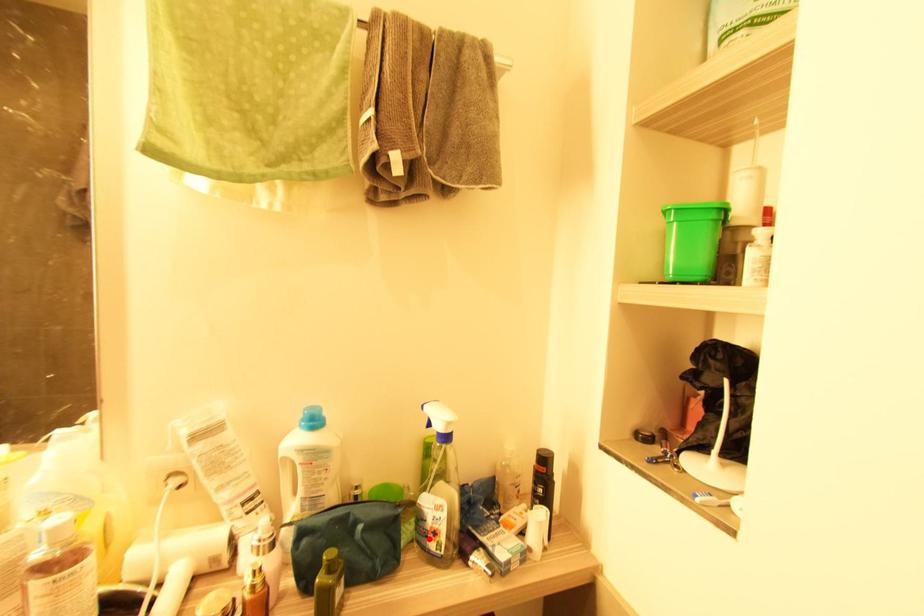
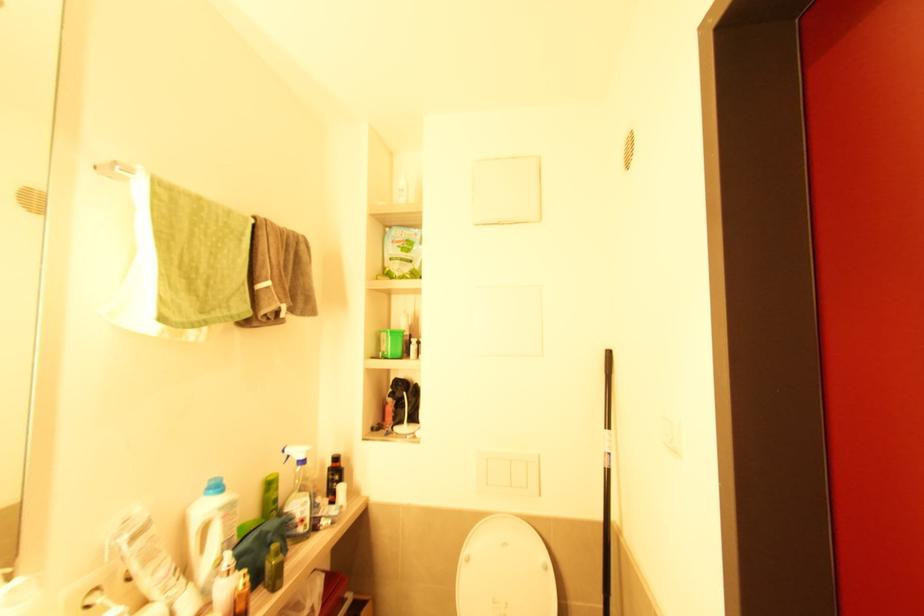
Question: I am providing you with two images of the same scene from different viewpoints. A red point is marked on the first image. Is the red point's position out of view in image 2?

Choices:
 (A) Yes
 (B) No

Answer: (B)